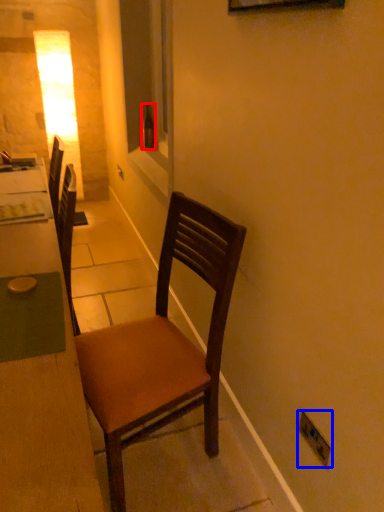
Question: Which of the following is the farthest to the observer, bottle (highlighted by a red box) or electric outlet (highlighted by a blue box)?

Choices:
 (A) bottle
 (B) electric outlet

Answer: (A)